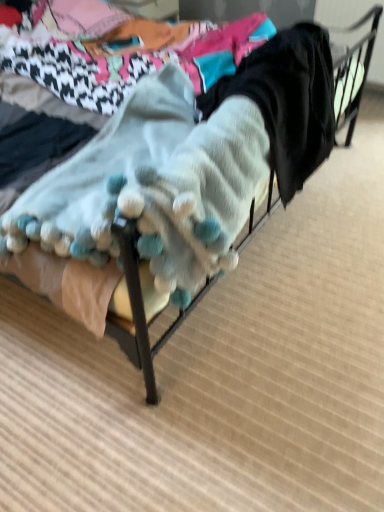
Question: Considering the relative positions of knitted wool socks at center and fuzzy white blanket at center in the image provided, is knitted wool socks at center to the right of fuzzy white blanket at center from the viewer's perspective?

Choices:
 (A) yes
 (B) no

Answer: (A)

Question: Considering the relative sizes of knitted wool socks at center and fuzzy white blanket at center in the image provided, is knitted wool socks at center shorter than fuzzy white blanket at center?

Choices:
 (A) no
 (B) yes

Answer: (A)

Question: Can you confirm if knitted wool socks at center is taller than fuzzy white blanket at center?

Choices:
 (A) no
 (B) yes

Answer: (B)

Question: Is knitted wool socks at center positioned with its back to fuzzy white blanket at center?

Choices:
 (A) yes
 (B) no

Answer: (A)

Question: Would you consider knitted wool socks at center to be distant from fuzzy white blanket at center?

Choices:
 (A) no
 (B) yes

Answer: (A)

Question: From a real-world perspective, does knitted wool socks at center stand above fuzzy white blanket at center?

Choices:
 (A) yes
 (B) no

Answer: (A)

Question: Is fuzzy white blanket at center wider than knitted wool socks at center?

Choices:
 (A) yes
 (B) no

Answer: (A)

Question: Could you tell me if fuzzy white blanket at center is facing knitted wool socks at center?

Choices:
 (A) yes
 (B) no

Answer: (A)

Question: Does fuzzy white blanket at center appear on the right side of knitted wool socks at center?

Choices:
 (A) no
 (B) yes

Answer: (A)

Question: Is the depth of fuzzy white blanket at center greater than that of knitted wool socks at center?

Choices:
 (A) no
 (B) yes

Answer: (A)

Question: From the image's perspective, is fuzzy white blanket at center under knitted wool socks at center?

Choices:
 (A) yes
 (B) no

Answer: (A)

Question: Is fuzzy white blanket at center to the left of knitted wool socks at center from the viewer's perspective?

Choices:
 (A) yes
 (B) no

Answer: (A)

Question: Is fuzzy white blanket at center bigger or smaller than knitted wool socks at center?

Choices:
 (A) small
 (B) big

Answer: (B)